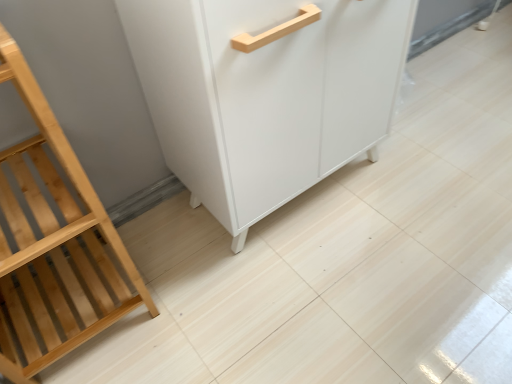
Image resolution: width=512 pixels, height=384 pixels. I want to click on vacant area to the right of natural wood shelf at left, so click(x=190, y=300).